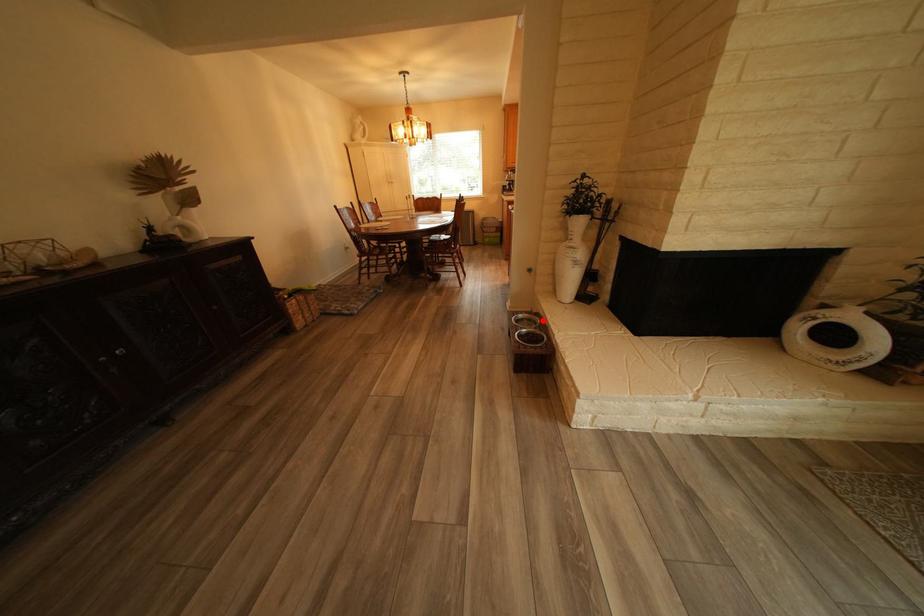
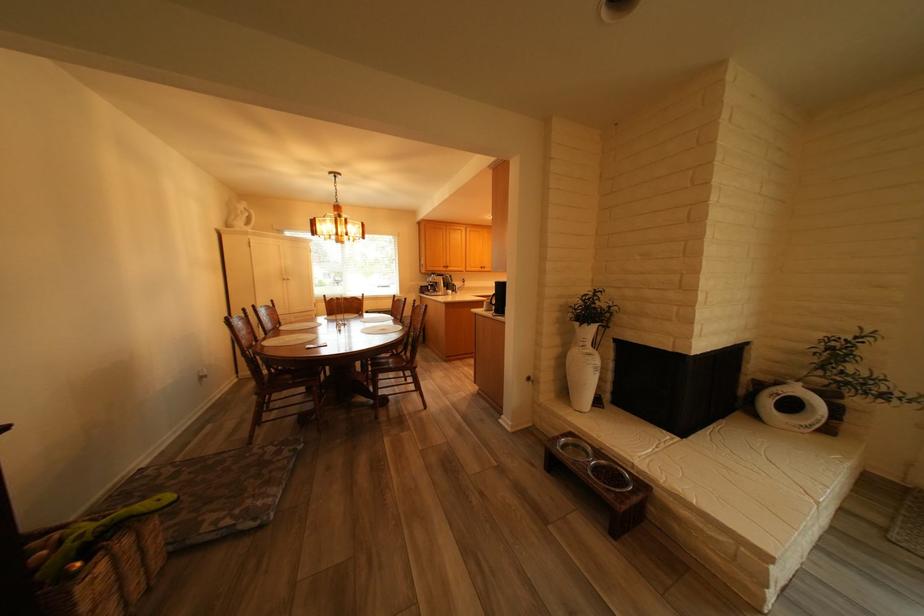
Where in the second image is the point corresponding to the highlighted location from the first image?

(590, 447)